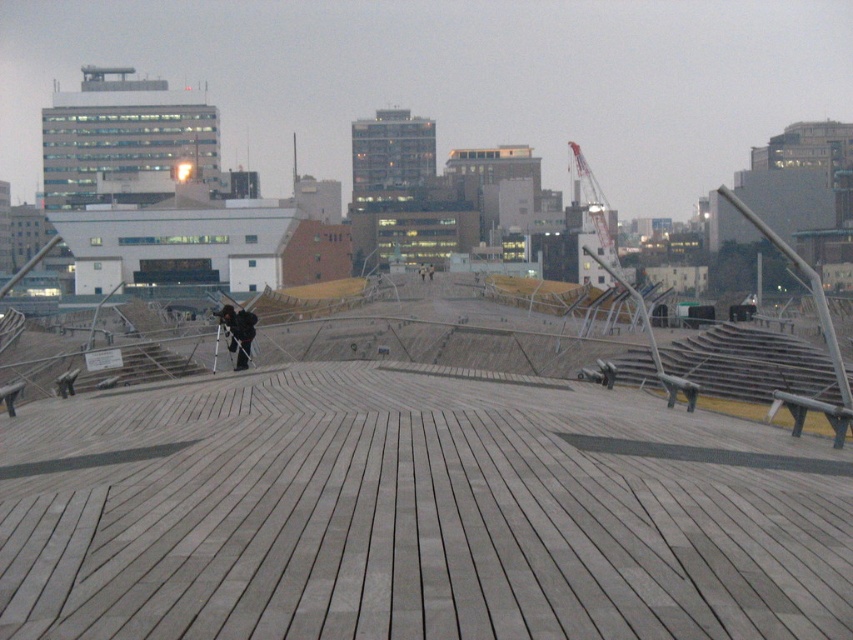
Question: Among these points, which one is farthest from the camera?

Choices:
 (A) (433, 273)
 (B) (236, 312)

Answer: (A)

Question: Is black matte jacket at center below dark gray fabric jacket at center?

Choices:
 (A) yes
 (B) no

Answer: (A)

Question: Does black matte jacket at center lie behind dark gray fabric jacket at center?

Choices:
 (A) yes
 (B) no

Answer: (B)

Question: Which of the following is the farthest from the observer?

Choices:
 (A) (236, 368)
 (B) (432, 272)

Answer: (B)

Question: Does black matte jacket at center appear on the left side of dark gray fabric jacket at center?

Choices:
 (A) yes
 (B) no

Answer: (A)